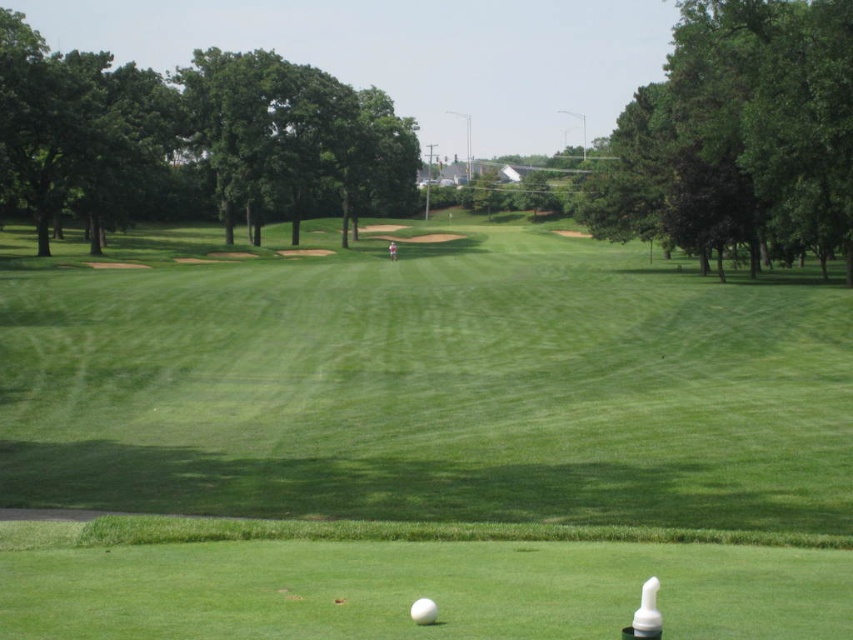
Can you confirm if green grassy field at center is positioned to the right of white matte golf ball at center?

Incorrect, green grassy field at center is not on the right side of white matte golf ball at center.

Looking at this image, who is positioned more to the left, green grassy field at center or white matte golf ball at center?

green grassy field at center

Between point (358, 305) and point (413, 620), which one is positioned behind?

Positioned behind is point (358, 305).

Identify the location of green grassy field at center. (422, 444).